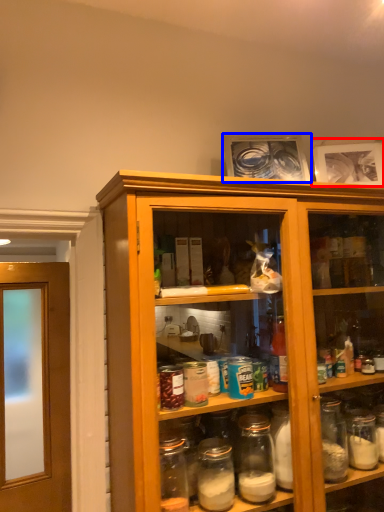
Question: Which object appears closest to the camera in this image, picture frame (highlighted by a red box) or picture frame (highlighted by a blue box)?

Choices:
 (A) picture frame
 (B) picture frame

Answer: (B)